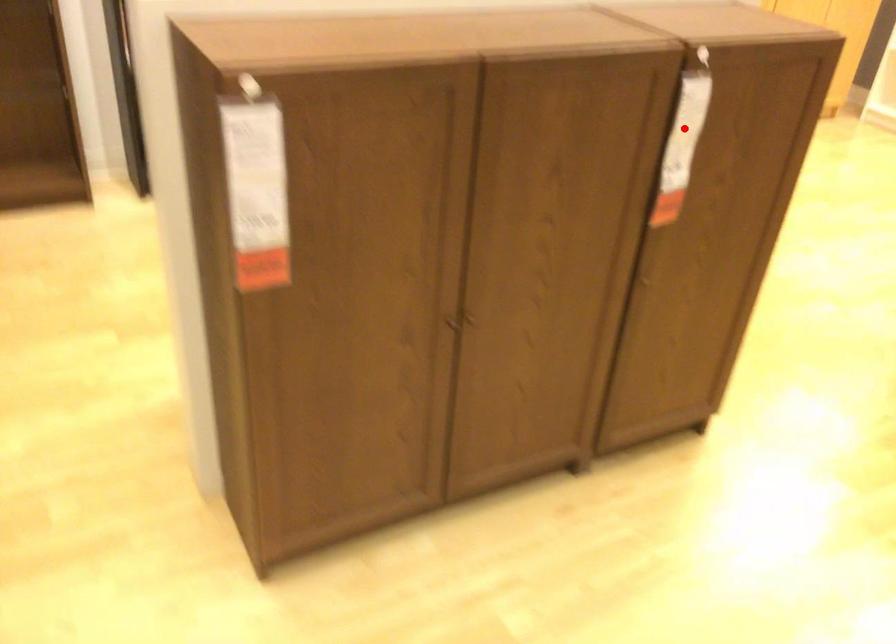
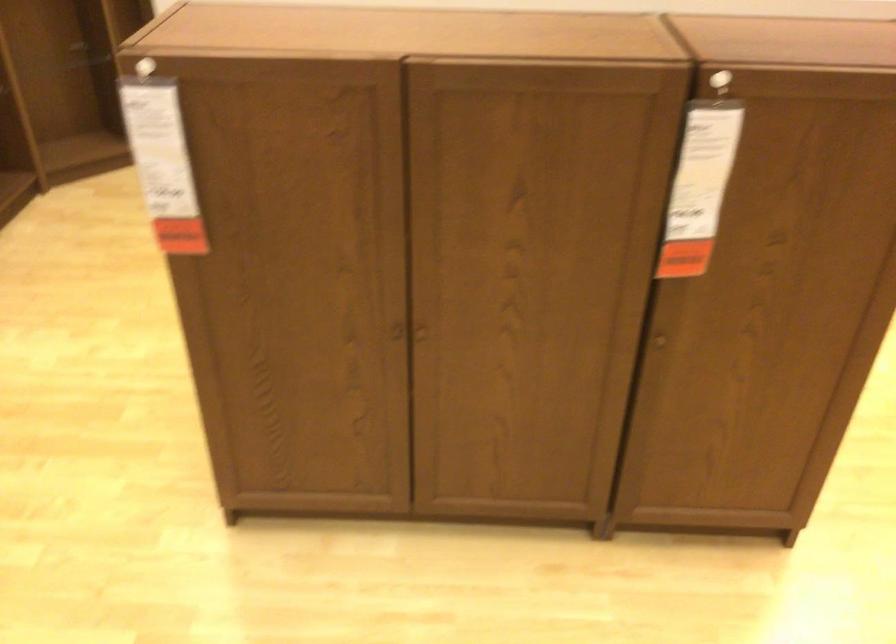
Question: I am providing you with two images of the same scene from different viewpoints. Image1 has a red point marked. In image2, the corresponding 3D location appears at what relative position? Reply with the corresponding letter.

Choices:
 (A) Closer
 (B) Farther

Answer: (A)